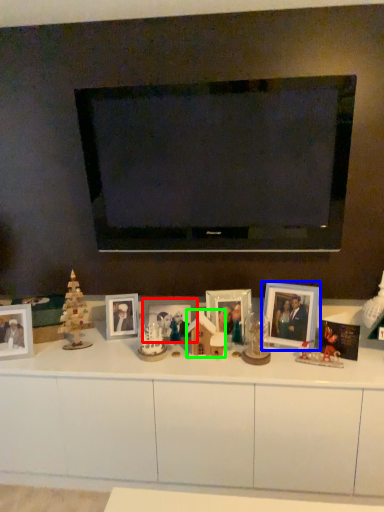
Question: Which object is positioned farthest from picture frame (highlighted by a red box)? Select from picture frame (highlighted by a blue box) and toy (highlighted by a green box).

Choices:
 (A) picture frame
 (B) toy

Answer: (A)